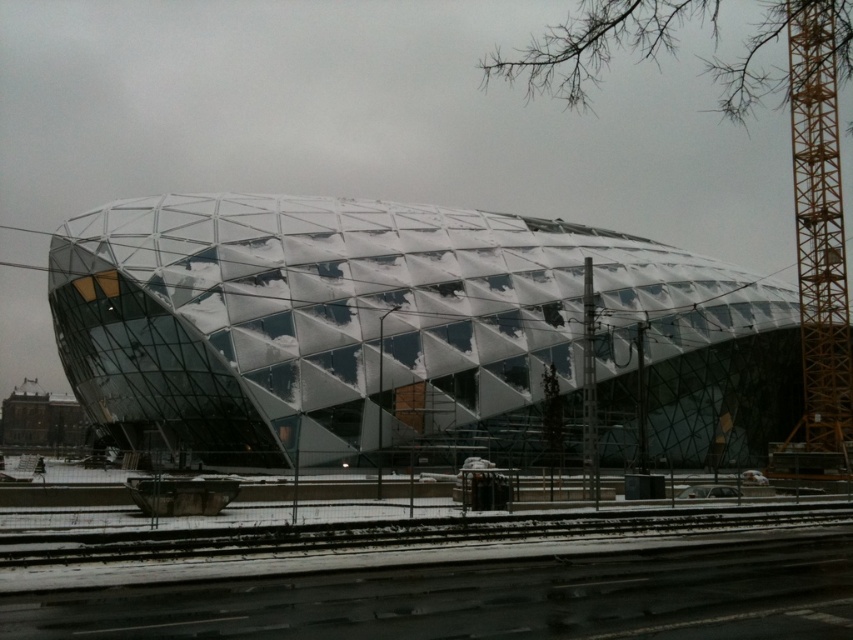
You are standing at the camera position and want to reach the point marked as point (668,312). If you walk straight ahead, will you reach that point before walking 100 meters?

Yes, because the point (668,312) is only 86.63 meters away from the camera position, which is less than 100 meters.

You are a construction worker who needs to install a new light fixture on the top of the metallic glass dome at center. The crane operator tells you that the yellow metallic crane at right can only reach up to 50 meters. Can the crane reach the top of the dome?

The metallic glass dome at center is shorter than the yellow metallic crane at right. Since the crane is taller, it can likely reach the top of the dome as long as the dome is within the crane operator specified 50 meters limit.

You are an architect evaluating the feasibility of placing a new sculpture between the metallic glass dome at center and the yellow metallic crane at right. The sculpture requires a minimum space of 10 meters between the two objects. Based on the scene, can the sculpture be placed there?

The metallic glass dome at center is larger than the yellow metallic crane at right, but the distance between them is not specified in the provided information. Therefore, it is impossible to determine if the sculpture can be placed there based solely on the given details.